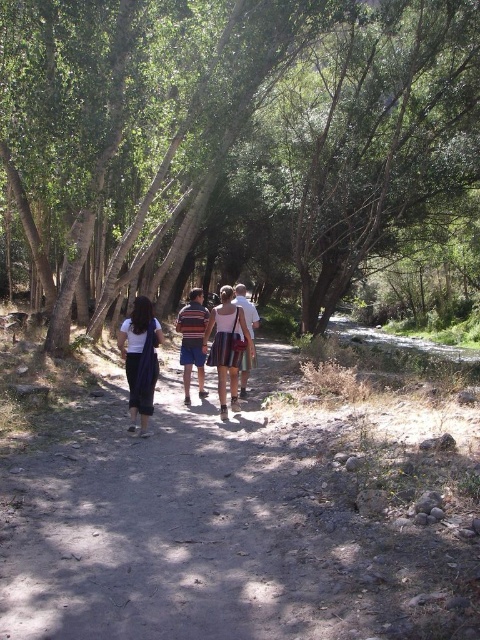
Question: Which is farther from the green leafy tree at center?

Choices:
 (A) white cotton shirt at center
 (B) striped shirt at center
 (C) dark blue fabric pants at center
 (D) striped fabric skirt at center

Answer: (C)

Question: Which of the following is the farthest from the observer?

Choices:
 (A) (321, 160)
 (B) (242, 346)

Answer: (A)

Question: In this image, where is green leafy tree at center located relative to dark blue fabric pants at center?

Choices:
 (A) right
 (B) left

Answer: (A)

Question: Where is dark blue fabric pants at center located in relation to white cotton shirt at center in the image?

Choices:
 (A) above
 (B) below

Answer: (B)

Question: Is green leafy tree at center below striped shirt at center?

Choices:
 (A) yes
 (B) no

Answer: (B)

Question: Among these objects, which one is farthest from the camera?

Choices:
 (A) striped shirt at center
 (B) green leafy tree at center

Answer: (B)